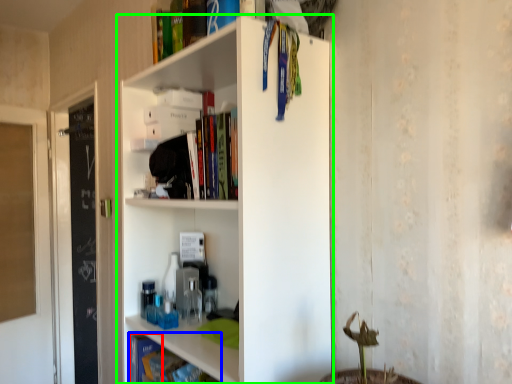
Question: Estimate the real-world distances between objects in this image. Which object is farther from book (highlighted by a red box), book (highlighted by a blue box) or shelf (highlighted by a green box)?

Choices:
 (A) book
 (B) shelf

Answer: (B)